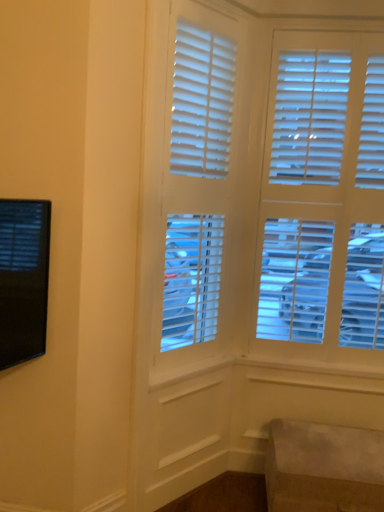
Question: Is white matte blinds at center outside suede-like beige ottoman at lower right?

Choices:
 (A) no
 (B) yes

Answer: (B)

Question: Is white matte blinds at center smaller than suede-like beige ottoman at lower right?

Choices:
 (A) yes
 (B) no

Answer: (B)

Question: Is white matte blinds at center next to suede-like beige ottoman at lower right and touching it?

Choices:
 (A) yes
 (B) no

Answer: (B)

Question: From a real-world perspective, does white matte blinds at center sit lower than suede-like beige ottoman at lower right?

Choices:
 (A) no
 (B) yes

Answer: (A)

Question: Can you confirm if white matte blinds at center is bigger than suede-like beige ottoman at lower right?

Choices:
 (A) yes
 (B) no

Answer: (A)

Question: Does white matte blinds at center appear on the right side of suede-like beige ottoman at lower right?

Choices:
 (A) yes
 (B) no

Answer: (B)

Question: Is suede-like beige ottoman at lower right at the right side of white matte blinds at center?

Choices:
 (A) yes
 (B) no

Answer: (A)

Question: Does suede-like beige ottoman at lower right have a lesser height compared to white matte blinds at center?

Choices:
 (A) yes
 (B) no

Answer: (A)

Question: Is suede-like beige ottoman at lower right taller than white matte blinds at center?

Choices:
 (A) no
 (B) yes

Answer: (A)

Question: Is suede-like beige ottoman at lower right oriented towards white matte blinds at center?

Choices:
 (A) yes
 (B) no

Answer: (B)

Question: Considering the relative sizes of suede-like beige ottoman at lower right and white matte blinds at center in the image provided, is suede-like beige ottoman at lower right wider than white matte blinds at center?

Choices:
 (A) no
 (B) yes

Answer: (B)

Question: Is white matte blinds at center surrounded by suede-like beige ottoman at lower right?

Choices:
 (A) yes
 (B) no

Answer: (B)

Question: Is white matte blinds at center inside or outside of suede-like beige ottoman at lower right?

Choices:
 (A) inside
 (B) outside

Answer: (B)